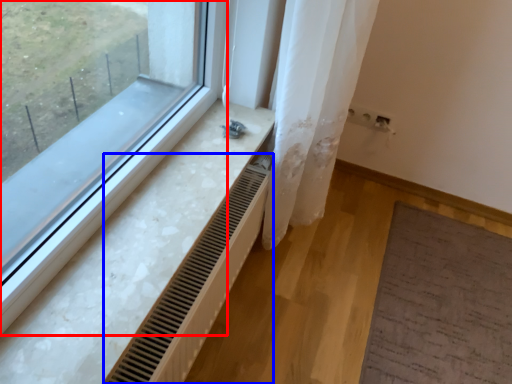
Question: Which point is further to the camera, window (highlighted by a red box) or radiator (highlighted by a blue box)?

Choices:
 (A) window
 (B) radiator

Answer: (B)